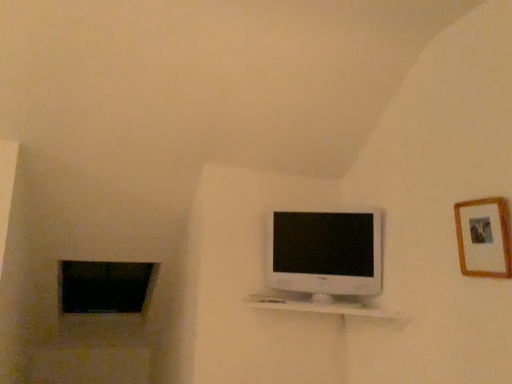
Locate an element on the screen. vacant space underneath white glossy television at center (from a real-world perspective) is located at coordinates (312, 304).